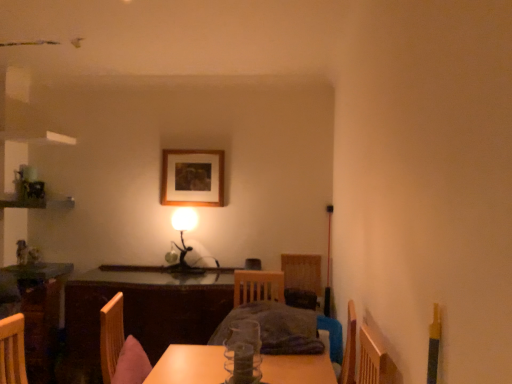
Question: From the image's perspective, is wooden picture frame at center over wooden table at center?

Choices:
 (A) yes
 (B) no

Answer: (A)

Question: Is wooden picture frame at center oriented towards wooden table at center?

Choices:
 (A) no
 (B) yes

Answer: (A)

Question: From a real-world perspective, is wooden picture frame at center on wooden table at center?

Choices:
 (A) no
 (B) yes

Answer: (B)

Question: Does wooden picture frame at center have a greater width compared to wooden table at center?

Choices:
 (A) no
 (B) yes

Answer: (A)

Question: Is wooden picture frame at center smaller than wooden table at center?

Choices:
 (A) no
 (B) yes

Answer: (B)

Question: Is wooden picture frame at center bigger than wooden table at center?

Choices:
 (A) no
 (B) yes

Answer: (A)

Question: Is clear glass vase at center oriented away from wooden picture frame at center?

Choices:
 (A) yes
 (B) no

Answer: (B)

Question: Is clear glass vase at center not inside wooden picture frame at center?

Choices:
 (A) no
 (B) yes

Answer: (B)

Question: Is clear glass vase at center to the right of wooden picture frame at center from the viewer's perspective?

Choices:
 (A) no
 (B) yes

Answer: (B)

Question: Can you confirm if clear glass vase at center is taller than wooden picture frame at center?

Choices:
 (A) no
 (B) yes

Answer: (A)

Question: Does clear glass vase at center have a lesser width compared to wooden picture frame at center?

Choices:
 (A) no
 (B) yes

Answer: (A)

Question: Is clear glass vase at center positioned before wooden picture frame at center?

Choices:
 (A) yes
 (B) no

Answer: (A)

Question: Is matte black table lamp at center further to camera compared to wooden table at center?

Choices:
 (A) no
 (B) yes

Answer: (B)